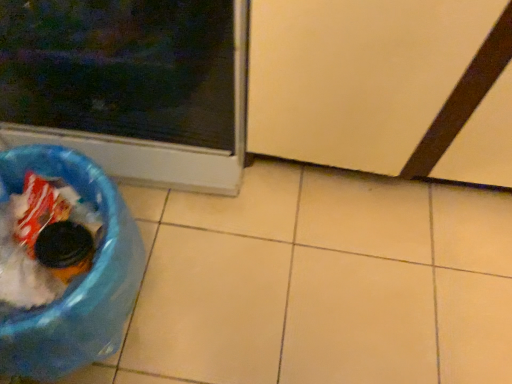
Question: Is blue plastic recycling bin at lower left wider than transparent plastic screen door at lower right?

Choices:
 (A) no
 (B) yes

Answer: (A)

Question: Is blue plastic recycling bin at lower left outside transparent plastic screen door at lower right?

Choices:
 (A) yes
 (B) no

Answer: (A)

Question: From the image's perspective, would you say blue plastic recycling bin at lower left is positioned over transparent plastic screen door at lower right?

Choices:
 (A) no
 (B) yes

Answer: (A)

Question: Would you say blue plastic recycling bin at lower left is a long distance from transparent plastic screen door at lower right?

Choices:
 (A) yes
 (B) no

Answer: (B)

Question: Does blue plastic recycling bin at lower left contain transparent plastic screen door at lower right?

Choices:
 (A) no
 (B) yes

Answer: (A)

Question: Does blue plastic recycling bin at lower left have a lesser height compared to transparent plastic screen door at lower right?

Choices:
 (A) yes
 (B) no

Answer: (A)

Question: Can you confirm if transparent plastic screen door at lower right is bigger than blue plastic recycling bin at lower left?

Choices:
 (A) no
 (B) yes

Answer: (B)

Question: Is transparent plastic screen door at lower right facing towards blue plastic recycling bin at lower left?

Choices:
 (A) no
 (B) yes

Answer: (A)

Question: Does transparent plastic screen door at lower right have a lesser height compared to blue plastic recycling bin at lower left?

Choices:
 (A) no
 (B) yes

Answer: (A)

Question: Is the position of transparent plastic screen door at lower right less distant than that of blue plastic recycling bin at lower left?

Choices:
 (A) no
 (B) yes

Answer: (B)

Question: Considering the relative sizes of transparent plastic screen door at lower right and blue plastic recycling bin at lower left in the image provided, is transparent plastic screen door at lower right thinner than blue plastic recycling bin at lower left?

Choices:
 (A) no
 (B) yes

Answer: (A)

Question: Is transparent plastic screen door at lower right positioned far away from blue plastic recycling bin at lower left?

Choices:
 (A) no
 (B) yes

Answer: (A)

Question: Considering the relative positions of transparent plastic screen door at lower right and matte plastic trash can at lower left in the image provided, is transparent plastic screen door at lower right behind matte plastic trash can at lower left?

Choices:
 (A) yes
 (B) no

Answer: (A)